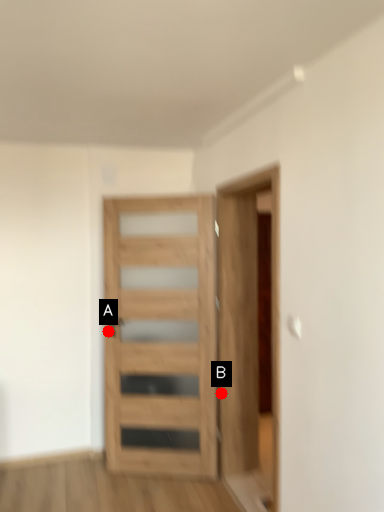
Question: Two points are circled on the image, labeled by A and B beside each circle. Which of the following is the closest to the observer?

Choices:
 (A) A is closer
 (B) B is closer

Answer: (B)